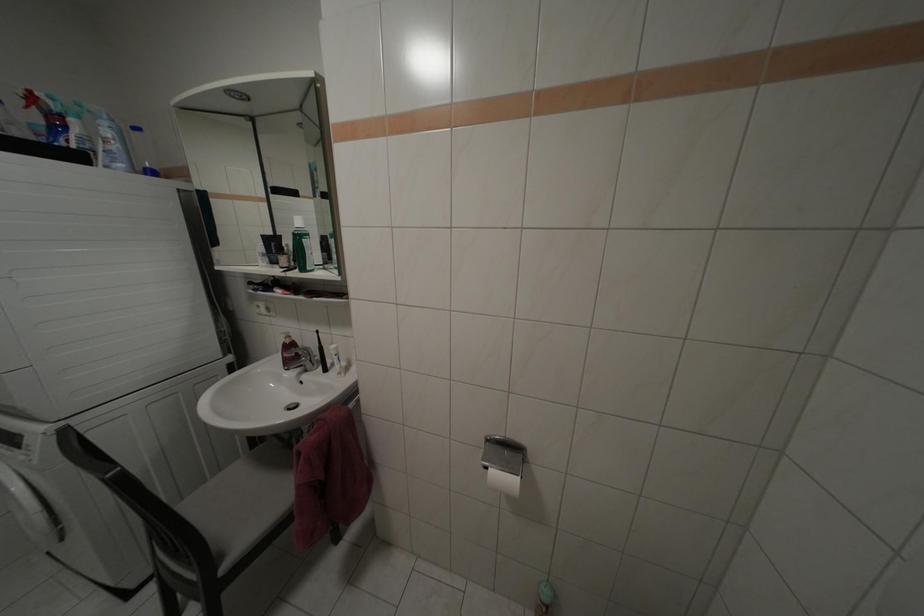
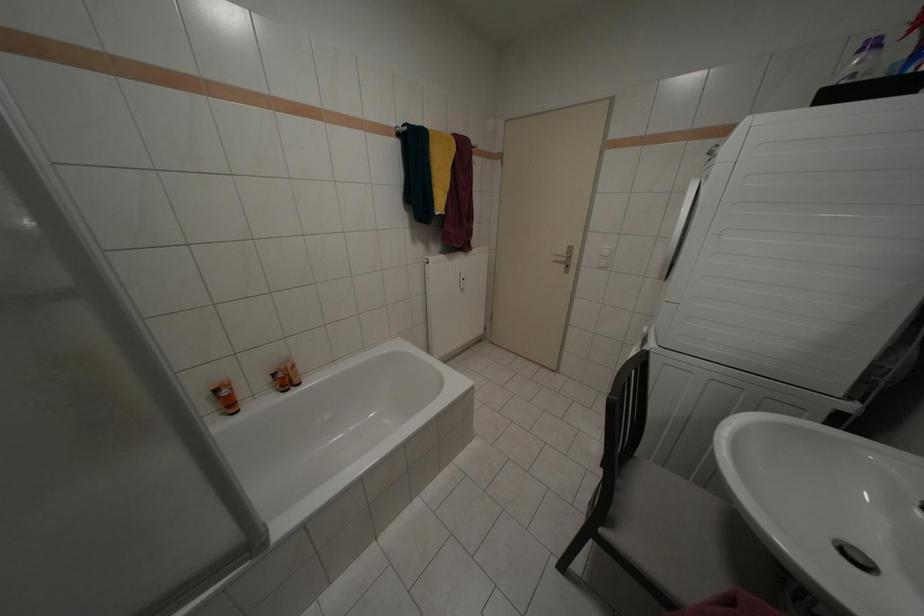
Based on the continuous images, in which direction is the camera rotating?

The rotation direction of the camera is left-down.